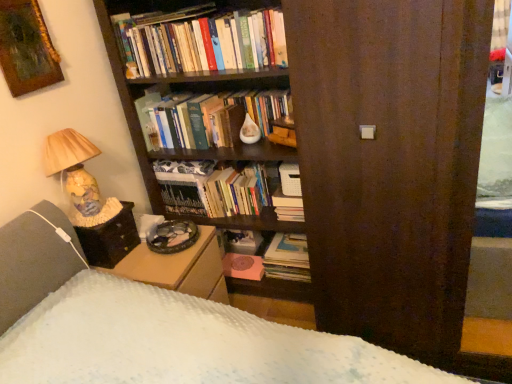
Question: Is brown wood screen door at center to the left or to the right of black fabric table at lower left in the image?

Choices:
 (A) right
 (B) left

Answer: (A)

Question: Considering their positions, is brown wood screen door at center located in front of or behind black fabric table at lower left?

Choices:
 (A) behind
 (B) front

Answer: (B)

Question: Considering the real-world distances, which object is closest to the black fabric table at lower left?

Choices:
 (A) hardcover book at center, acting as the 3th book starting from the bottom
 (B) hardcover books at upper center, the 4th book in the bottom-to-top sequence
 (C) wooden framed painting at upper left
 (D) brown wood screen door at center
 (E) hardcover book at center, which appears as the 3th book when viewed from the top

Answer: (A)

Question: Which of these objects is positioned closest to the black fabric table at lower left?

Choices:
 (A) brown wood screen door at center
 (B) hardcover book at center, marked as the second book in a top-to-bottom arrangement
 (C) matte paper stack of books at center, marked as the 1th book in a bottom-to-top arrangement
 (D) hardcover books at upper center, the first book positioned from the top
 (E) hardcover book at center, arranged as the 2th book when ordered from the bottom

Answer: (B)